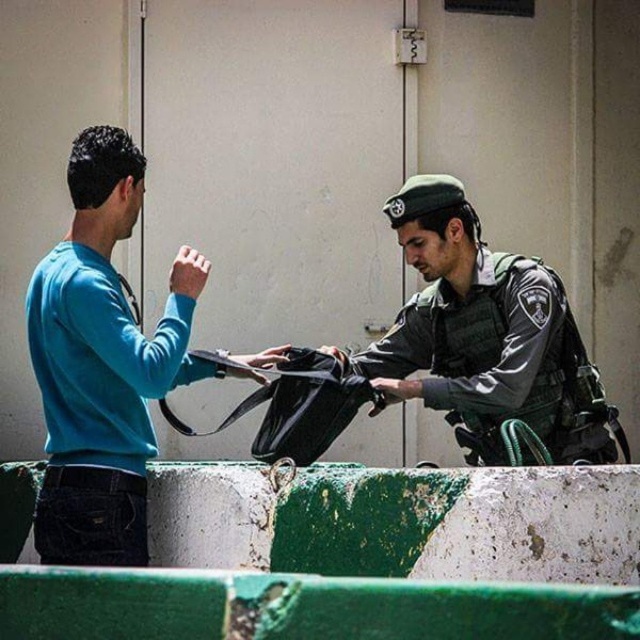
Question: Can you confirm if teal matte sweater at left is positioned to the right of green uniformed officer at center?

Choices:
 (A) yes
 (B) no

Answer: (B)

Question: Which point is closer to the camera?

Choices:
 (A) (371, 372)
 (B) (122, 484)

Answer: (B)

Question: Considering the relative positions of teal matte sweater at left and green uniformed officer at center in the image provided, where is teal matte sweater at left located with respect to green uniformed officer at center?

Choices:
 (A) left
 (B) right

Answer: (A)

Question: Which object appears farthest from the camera in this image?

Choices:
 (A) teal matte sweater at left
 (B) green uniformed officer at center

Answer: (B)

Question: Is teal matte sweater at left bigger than green uniformed officer at center?

Choices:
 (A) no
 (B) yes

Answer: (A)

Question: Which object is closer to the camera taking this photo?

Choices:
 (A) teal matte sweater at left
 (B) green uniformed officer at center

Answer: (A)